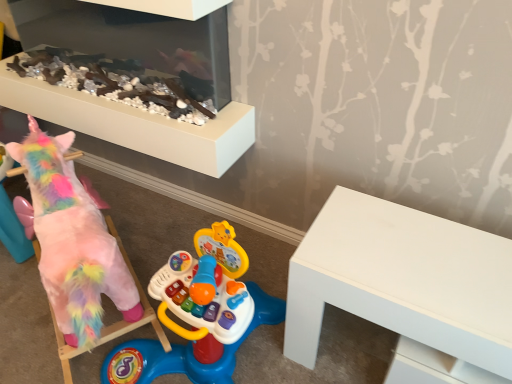
The image size is (512, 384). In order to click on white matte table at right in this screenshot , I will do `click(406, 289)`.

Describe the element at coordinates (130, 81) in the screenshot. The height and width of the screenshot is (384, 512). I see `smooth white fireplace at upper center` at that location.

Locate an element on the screen. fluffy pink unicorn at left is located at coordinates (73, 240).

From a real-world perspective, is white matte table at right physically located above or below fluffy pink unicorn at left?

Clearly, from a real-world perspective, white matte table at right is below fluffy pink unicorn at left.

How many degrees apart are the facing directions of white matte table at right and fluffy pink unicorn at left?

There is a 29.8-degree angle between the facing directions of white matte table at right and fluffy pink unicorn at left.

Consider the image. Is white matte table at right not near fluffy pink unicorn at left?

No, white matte table at right is not far from fluffy pink unicorn at left.

Could you tell me if white matte table at right is turned towards fluffy pink unicorn at left?

No, white matte table at right is not oriented towards fluffy pink unicorn at left.

Is fluffy pink unicorn at left inside the boundaries of smooth white fireplace at upper center, or outside?

fluffy pink unicorn at left lies outside smooth white fireplace at upper center.

Is fluffy pink unicorn at left oriented towards smooth white fireplace at upper center?

No, fluffy pink unicorn at left is not turned towards smooth white fireplace at upper center.

How many degrees apart are the facing directions of fluffy pink unicorn at left and smooth white fireplace at upper center?

fluffy pink unicorn at left and smooth white fireplace at upper center are facing 29.8 degrees away from each other.

Is fluffy pink unicorn at left next to smooth white fireplace at upper center and touching it?

No, fluffy pink unicorn at left is not beside smooth white fireplace at upper center.

Does smooth white fireplace at upper center have a lesser height compared to fluffy pink unicorn at left?

Indeed, smooth white fireplace at upper center has a lesser height compared to fluffy pink unicorn at left.

Is smooth white fireplace at upper center positioned far away from fluffy pink unicorn at left?

No, there isn't a large distance between smooth white fireplace at upper center and fluffy pink unicorn at left.

Is fluffy pink unicorn at left at the back of smooth white fireplace at upper center?

smooth white fireplace at upper center is not turned away from fluffy pink unicorn at left.

From a real-world perspective, is smooth white fireplace at upper center located beneath white matte table at right?

No, from a real-world perspective, smooth white fireplace at upper center is not under white matte table at right.

Considering the sizes of objects smooth white fireplace at upper center and white matte table at right in the image provided, who is taller, smooth white fireplace at upper center or white matte table at right?

white matte table at right is taller.

From the image's perspective, is smooth white fireplace at upper center over white matte table at right?

Yes.

Between smooth white fireplace at upper center and white matte table at right, which one appears on the left side from the viewer's perspective?

smooth white fireplace at upper center is more to the left.

From the image's perspective, who appears lower, white matte table at right or smooth white fireplace at upper center?

white matte table at right is shown below in the image.

Which object is closer to the camera taking this photo, white matte table at right or smooth white fireplace at upper center?

white matte table at right is closer to the camera.

Can you tell me how much white matte table at right and smooth white fireplace at upper center differ in facing direction?

0.000329 degrees.

Is white matte table at right at the left side of smooth white fireplace at upper center?

Incorrect, white matte table at right is not on the left side of smooth white fireplace at upper center.

Could you tell me if fluffy pink unicorn at left is turned towards white matte table at right?

No, fluffy pink unicorn at left is not aimed at white matte table at right.

From the image's perspective, relative to white matte table at right, is fluffy pink unicorn at left above or below?

fluffy pink unicorn at left is situated higher than white matte table at right in the image.

Looking at this image, from a real-world perspective, is fluffy pink unicorn at left on top of white matte table at right?

Yes, from a real-world perspective, fluffy pink unicorn at left is above white matte table at right.

Can you tell me how much fluffy pink unicorn at left and white matte table at right differ in facing direction?

29.8 degrees.

Locate an element on the screen. The image size is (512, 384). toy behind the white matte table at right is located at coordinates click(x=73, y=240).

Locate an element on the screen. This screenshot has height=384, width=512. toy in front of the smooth white fireplace at upper center is located at coordinates (73, 240).

Which object lies nearer to the anchor point white matte table at right, smooth white fireplace at upper center or fluffy pink unicorn at left?

The object closer to white matte table at right is fluffy pink unicorn at left.

When comparing their distances from fluffy pink unicorn at left, does smooth white fireplace at upper center or white matte table at right seem further?

Based on the image, white matte table at right appears to be further to fluffy pink unicorn at left.

Estimate the real-world distances between objects in this image. Which object is closer to white matte table at right, fluffy pink unicorn at left or smooth white fireplace at upper center?

Among the two, fluffy pink unicorn at left is located nearer to white matte table at right.

Based on their spatial positions, is white matte table at right or smooth white fireplace at upper center further from fluffy pink unicorn at left?

Among the two, white matte table at right is located further to fluffy pink unicorn at left.

From the image, which object appears to be farther from smooth white fireplace at upper center, fluffy pink unicorn at left or white matte table at right?

white matte table at right is positioned further to the anchor smooth white fireplace at upper center.

From the image, which object appears to be farther from smooth white fireplace at upper center, white matte table at right or fluffy pink unicorn at left?

white matte table at right is further to smooth white fireplace at upper center.

Where is `furniture located between fluffy pink unicorn at left and white matte table at right in the left-right direction`? furniture located between fluffy pink unicorn at left and white matte table at right in the left-right direction is located at coordinates (130, 81).